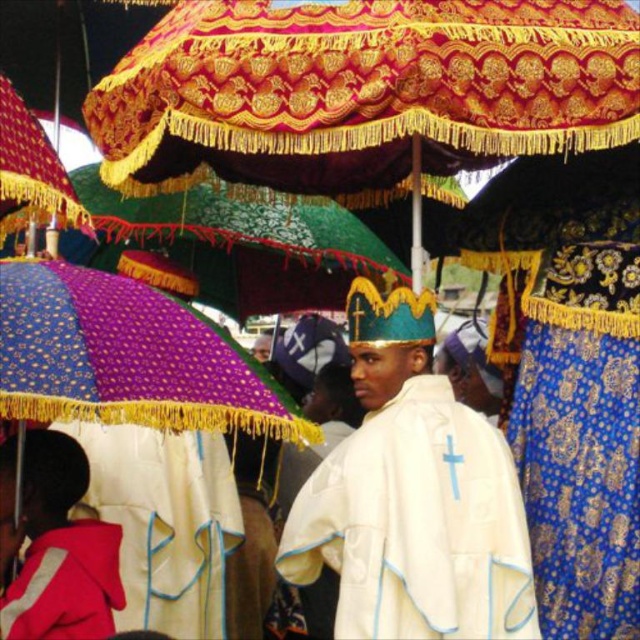
Is white satin robe at center further to camera compared to red fleece jacket at lower left?

Yes, it is.

Does white satin robe at center have a lesser width compared to red fleece jacket at lower left?

No.

Which is behind, point (458, 522) or point (102, 548)?

Point (458, 522)

Identify the location of white satin robe at center. (417, 524).